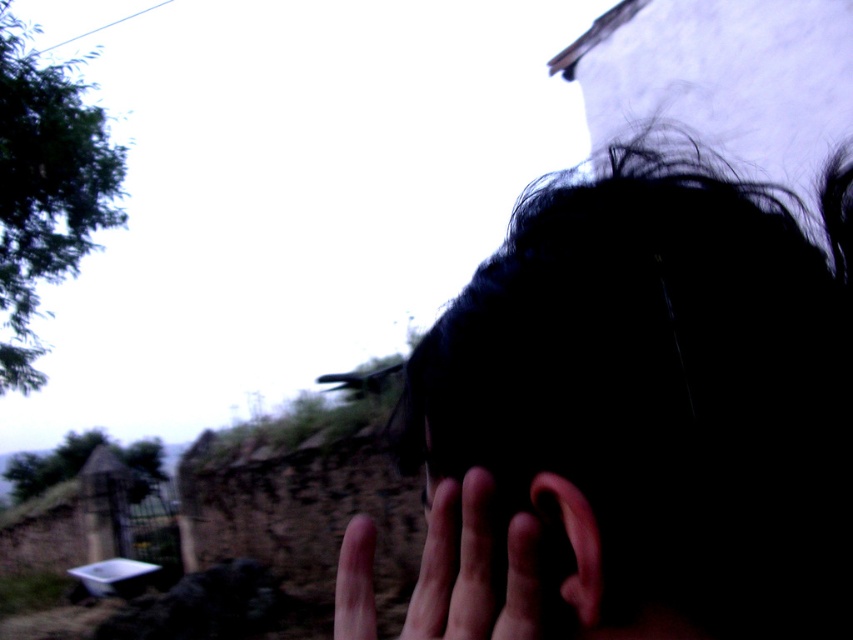
Can you confirm if black matte hair at upper right is taller than pink flesh-colored ear at center?

Yes.

Between black matte hair at upper right and pink flesh-colored ear at center, which one appears on the left side from the viewer's perspective?

Positioned to the left is pink flesh-colored ear at center.

Does point (840, 611) come behind point (564, 577)?

Yes.

Find the location of a particular element. The image size is (853, 640). black matte hair at upper right is located at coordinates pos(659,397).

Which is behind, point (358, 618) or point (550, 516)?

Positioned behind is point (358, 618).

Is dark skin hand at center further to camera compared to pink flesh-colored ear at center?

Yes, dark skin hand at center is further from the viewer.

Is point (550, 602) farther from viewer compared to point (567, 531)?

Yes, point (550, 602) is farther from viewer.

This screenshot has height=640, width=853. What are the coordinates of `dark skin hand at center` in the screenshot? It's located at pos(479,570).

Who is lower down, black matte hair at upper right or dark skin hand at center?

dark skin hand at center is below.

Does black matte hair at upper right appear on the left side of dark skin hand at center?

Incorrect, black matte hair at upper right is not on the left side of dark skin hand at center.

Between point (795, 317) and point (428, 632), which one is positioned behind?

Positioned behind is point (428, 632).

Locate an element on the screen. The height and width of the screenshot is (640, 853). black matte hair at upper right is located at coordinates coord(659,397).